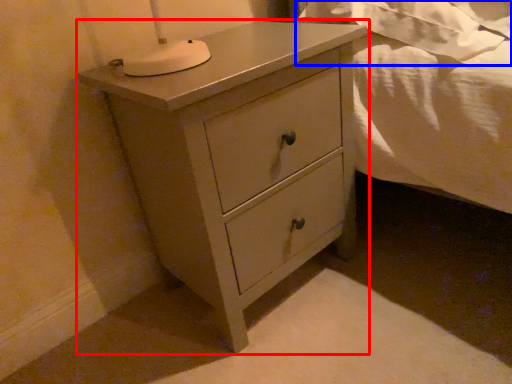
Question: Among these objects, which one is farthest to the camera, chest of drawers (highlighted by a red box) or sheet (highlighted by a blue box)?

Choices:
 (A) chest of drawers
 (B) sheet

Answer: (B)